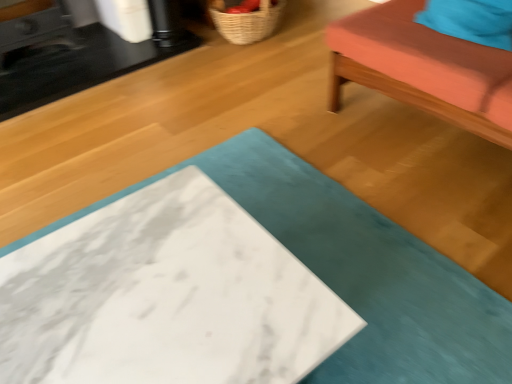
The height and width of the screenshot is (384, 512). Find the location of `black marble table at upper left, the second table from the front`. black marble table at upper left, the second table from the front is located at coordinates (77, 54).

The width and height of the screenshot is (512, 384). Describe the element at coordinates (77, 54) in the screenshot. I see `black marble table at upper left, which is the 1th table from back to front` at that location.

This screenshot has height=384, width=512. In order to click on teal fabric cushion at upper right in this screenshot , I will do `click(423, 69)`.

Find the location of a particular element. The image size is (512, 384). basket that is behind the teal fabric pillow at upper right is located at coordinates (246, 22).

Considering the sizes of teal fabric pillow at upper right and woven straw basket at upper center in the image, is teal fabric pillow at upper right wider or thinner than woven straw basket at upper center?

teal fabric pillow at upper right is thinner than woven straw basket at upper center.

From a real-world perspective, which object stands above the other?

teal fabric pillow at upper right, from a real-world perspective.

Which object is thinner, teal fabric pillow at upper right or white marble table at center, marked as the second table in a back-to-front arrangement?

teal fabric pillow at upper right is thinner.

Considering the relative sizes of teal fabric pillow at upper right and white marble table at center, which is the second table in top-to-bottom order, in the image provided, is teal fabric pillow at upper right taller than white marble table at center, which is the second table in top-to-bottom order,?

No.

Based on the photo, is white marble table at center, which ranks as the 1th table in front-to-back order, at the back of teal fabric pillow at upper right?

teal fabric pillow at upper right is not turned away from white marble table at center, which ranks as the 1th table in front-to-back order.

Measure the distance between white marble table at center, marked as the second table in a back-to-front arrangement, and teal fabric cushion at upper right.

A distance of 22.63 inches exists between white marble table at center, marked as the second table in a back-to-front arrangement, and teal fabric cushion at upper right.

Can you confirm if white marble table at center, arranged as the 1th table when ordered from the bottom, is positioned to the left of teal fabric cushion at upper right?

Correct, you'll find white marble table at center, arranged as the 1th table when ordered from the bottom, to the left of teal fabric cushion at upper right.

Is white marble table at center, which is the second table in top-to-bottom order, positioned beyond the bounds of teal fabric cushion at upper right?

white marble table at center, which is the second table in top-to-bottom order, is positioned outside teal fabric cushion at upper right.

Is the surface of white marble table at center, marked as the second table in a back-to-front arrangement, in direct contact with teal fabric cushion at upper right?

white marble table at center, marked as the second table in a back-to-front arrangement, is not next to teal fabric cushion at upper right, and they're not touching.

At what (x,y) coordinates should I click in order to perform the action: click on basket lying behind the teal fabric cushion at upper right. Please return your answer as a coordinate pair (x, y). This screenshot has width=512, height=384. Looking at the image, I should click on (246, 22).

Can you confirm if woven straw basket at upper center is shorter than teal fabric cushion at upper right?

Correct, woven straw basket at upper center is not as tall as teal fabric cushion at upper right.

How many degrees apart are the facing directions of woven straw basket at upper center and teal fabric cushion at upper right?

There is a 91-degree angle between the facing directions of woven straw basket at upper center and teal fabric cushion at upper right.

From a real-world perspective, who is located higher, woven straw basket at upper center or teal fabric cushion at upper right?

teal fabric cushion at upper right.

From the image's perspective, which one is positioned higher, teal fabric cushion at upper right or woven straw basket at upper center?

woven straw basket at upper center, from the image's perspective.

In terms of width, does teal fabric cushion at upper right look wider or thinner when compared to woven straw basket at upper center?

Considering their sizes, teal fabric cushion at upper right looks broader than woven straw basket at upper center.

Is teal fabric cushion at upper right to the left of woven straw basket at upper center from the viewer's perspective?

In fact, teal fabric cushion at upper right is to the right of woven straw basket at upper center.

How many degrees apart are the facing directions of woven straw basket at upper center and white marble table at center, which is the second table in top-to-bottom order?

woven straw basket at upper center and white marble table at center, which is the second table in top-to-bottom order, are facing 87 degrees away from each other.

Consider the image. From a real-world perspective, who is located lower, woven straw basket at upper center or white marble table at center, marked as the second table in a back-to-front arrangement?

woven straw basket at upper center is physically lower.

Considering the positions of point (257, 36) and point (418, 361), is point (257, 36) closer or farther from the camera than point (418, 361)?

Point (257, 36) is positioned farther from the camera compared to point (418, 361).

The width and height of the screenshot is (512, 384). Identify the location of basket behind the white marble table at center, marked as the second table in a back-to-front arrangement. (246, 22).

In the scene shown: Does white marble table at center, which ranks as the 1th table in front-to-back order, appear on the right side of woven straw basket at upper center?

No.

Looking at this image, from a real-world perspective, between white marble table at center, arranged as the 1th table when ordered from the bottom, and woven straw basket at upper center, who is vertically lower?

In real-world perspective, woven straw basket at upper center is lower.

Can you see white marble table at center, which is the second table in top-to-bottom order, touching woven straw basket at upper center?

No.

From the image's perspective, is white marble table at center, arranged as the 1th table when ordered from the bottom, located above woven straw basket at upper center?

No, from the image's perspective, white marble table at center, arranged as the 1th table when ordered from the bottom, is not over woven straw basket at upper center.

At what (x,y) coordinates should I click in order to perform the action: click on basket beneath the teal fabric pillow at upper right (from a real-world perspective). Please return your answer as a coordinate pair (x, y). Looking at the image, I should click on (246, 22).

Find the location of a particular element. This screenshot has height=384, width=512. pillow that is above the white marble table at center, which is the second table in top-to-bottom order (from the image's perspective) is located at coordinates (471, 20).

Considering their positions, is black marble table at upper left, which ranks as the second table in bottom-to-top order, positioned closer to teal fabric pillow at upper right than teal fabric cushion at upper right?

Among the two, teal fabric cushion at upper right is located nearer to teal fabric pillow at upper right.

Looking at the image, which one is located closer to black marble table at upper left, which ranks as the second table in bottom-to-top order, teal fabric cushion at upper right or woven straw basket at upper center?

woven straw basket at upper center is positioned closer to the anchor black marble table at upper left, which ranks as the second table in bottom-to-top order.

Which object lies nearer to the anchor point woven straw basket at upper center, teal fabric cushion at upper right or black marble table at upper left, which ranks as the second table in bottom-to-top order?

Based on the image, black marble table at upper left, which ranks as the second table in bottom-to-top order, appears to be nearer to woven straw basket at upper center.

From the image, which object appears to be farther from white marble table at center, marked as the second table in a back-to-front arrangement, black marble table at upper left, which ranks as the second table in bottom-to-top order, or woven straw basket at upper center?

Among the two, black marble table at upper left, which ranks as the second table in bottom-to-top order, is located further to white marble table at center, marked as the second table in a back-to-front arrangement.

When comparing their distances from teal fabric cushion at upper right, does teal fabric pillow at upper right or woven straw basket at upper center seem closer?

teal fabric pillow at upper right is closer to teal fabric cushion at upper right.

From the image, which object appears to be farther from teal fabric cushion at upper right, white marble table at center, marked as the second table in a back-to-front arrangement, or teal fabric pillow at upper right?

Based on the image, white marble table at center, marked as the second table in a back-to-front arrangement, appears to be further to teal fabric cushion at upper right.

Based on their spatial positions, is black marble table at upper left, which ranks as the second table in bottom-to-top order, or teal fabric pillow at upper right closer to woven straw basket at upper center?

black marble table at upper left, which ranks as the second table in bottom-to-top order, lies closer to woven straw basket at upper center than the other object.

When comparing their distances from teal fabric cushion at upper right, does white marble table at center, arranged as the 1th table when ordered from the bottom, or woven straw basket at upper center seem closer?

The object closer to teal fabric cushion at upper right is white marble table at center, arranged as the 1th table when ordered from the bottom.

Find the location of `pillow between white marble table at center, which ranks as the 1th table in front-to-back order, and teal fabric cushion at upper right, in the horizontal direction`. pillow between white marble table at center, which ranks as the 1th table in front-to-back order, and teal fabric cushion at upper right, in the horizontal direction is located at coordinates (471, 20).

Image resolution: width=512 pixels, height=384 pixels. I want to click on table located between black marble table at upper left, the second table from the front, and teal fabric cushion at upper right in the left-right direction, so click(x=359, y=271).

What are the coordinates of `basket situated between black marble table at upper left, which is the 1th table from back to front, and teal fabric pillow at upper right from left to right` in the screenshot? It's located at (246, 22).

Find the location of a particular element. The width and height of the screenshot is (512, 384). pillow located between teal fabric cushion at upper right and woven straw basket at upper center in the depth direction is located at coordinates (471, 20).